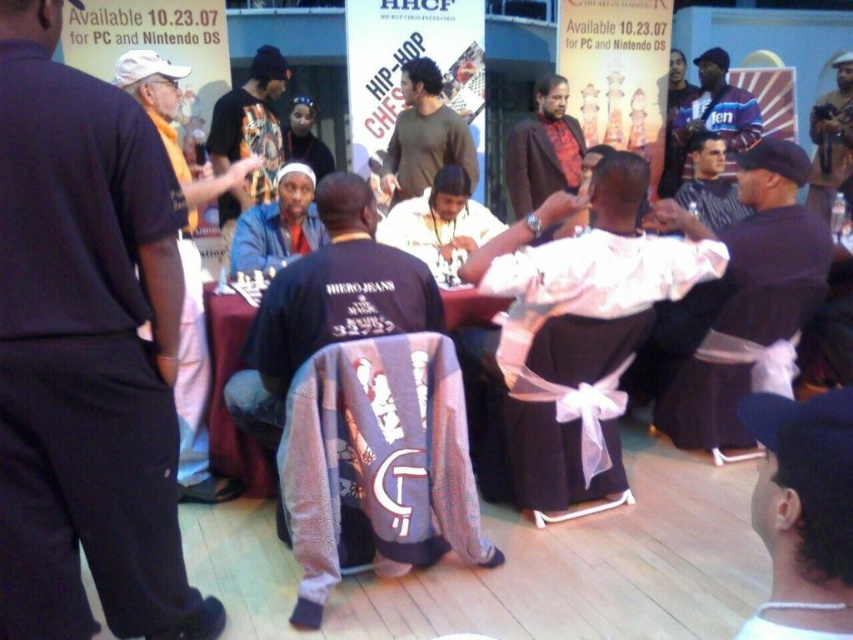
Is point (781, 321) behind point (209, 170)?

That is False.

Who is taller, black fabric shirt at right or dark blue shirt at left?

dark blue shirt at left is taller.

This screenshot has width=853, height=640. What do you see at coordinates (740, 292) in the screenshot?
I see `black fabric shirt at right` at bounding box center [740, 292].

Find the location of a particular element. This screenshot has width=853, height=640. black fabric shirt at right is located at coordinates (740, 292).

Is point (219, 145) less distant than point (682, 208)?

No.

Does printed cotton shirt at upper center have a greater height compared to white satin robe at center?

Yes.

Between point (285, 74) and point (704, 220), which one is positioned in front?

Point (704, 220) is in front.

Where is `printed cotton shirt at upper center`? The width and height of the screenshot is (853, 640). printed cotton shirt at upper center is located at coordinates (248, 132).

Between black cap at lower right and brown textured shirt at center, which one appears on the left side from the viewer's perspective?

From the viewer's perspective, brown textured shirt at center appears more on the left side.

Consider the image. Does black cap at lower right have a greater height compared to brown textured shirt at center?

No.

What do you see at coordinates (804, 513) in the screenshot? I see `black cap at lower right` at bounding box center [804, 513].

I want to click on black cap at lower right, so click(x=804, y=513).